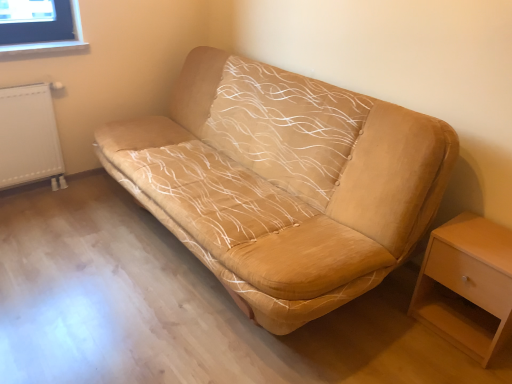
Question: Relative to beige suede sofa at center, is light wood/wooden nightstand at lower right in front or behind?

Choices:
 (A) front
 (B) behind

Answer: (B)

Question: Would you say light wood/wooden nightstand at lower right is inside or outside beige suede sofa at center?

Choices:
 (A) inside
 (B) outside

Answer: (B)

Question: Estimate the real-world distances between objects in this image. Which object is farther from the beige suede sofa at center?

Choices:
 (A) light wood/wooden nightstand at lower right
 (B) white textured radiator at left

Answer: (B)

Question: Which is farther from the beige suede sofa at center?

Choices:
 (A) white textured radiator at left
 (B) light wood/wooden nightstand at lower right

Answer: (A)